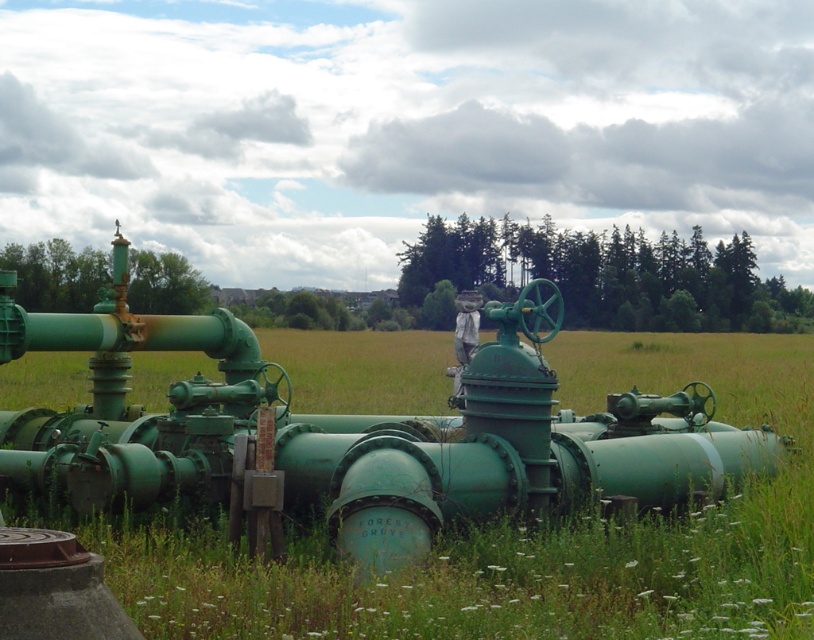
Question: Among these points, which one is nearest to the camera?

Choices:
 (A) (462, 292)
 (B) (742, 596)

Answer: (B)

Question: Can you confirm if green matte pipes at center is positioned to the right of white fabric mannequin at center?

Choices:
 (A) yes
 (B) no

Answer: (A)

Question: Which point appears closest to the camera in this image?

Choices:
 (A) (460, 317)
 (B) (640, 616)

Answer: (B)

Question: Does green matte pipes at center have a larger size compared to white fabric mannequin at center?

Choices:
 (A) no
 (B) yes

Answer: (B)

Question: Is green matte pipes at center below white fabric mannequin at center?

Choices:
 (A) yes
 (B) no

Answer: (A)